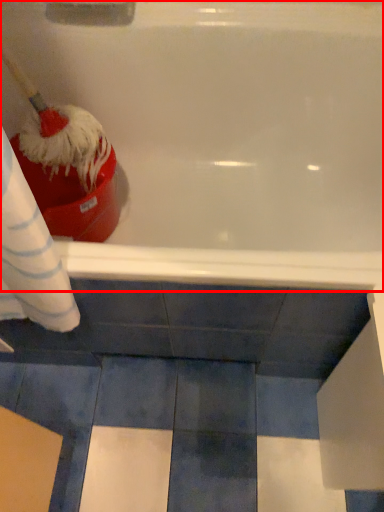
Question: From the image's perspective, where is bathtub (annotated by the red box) located in relation to brush in the image?

Choices:
 (A) above
 (B) below

Answer: (B)